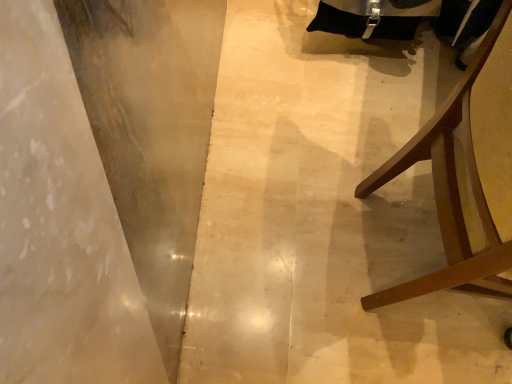
What do you see at coordinates (451, 192) in the screenshot? This screenshot has width=512, height=384. I see `brown wood chair at right` at bounding box center [451, 192].

Where is `brown wood chair at right`? brown wood chair at right is located at coordinates (451, 192).

Measure the distance between point [291,359] and camera.

Point [291,359] is 3.54 feet from camera.

What do you see at coordinates (325, 216) in the screenshot?
I see `smooth concrete at left` at bounding box center [325, 216].

Find the location of a particular element. The height and width of the screenshot is (384, 512). smooth concrete at left is located at coordinates (325, 216).

Where is `brown wood chair at right`? brown wood chair at right is located at coordinates (451, 192).

Does smooth concrete at left appear on the right side of brown wood chair at right?

No.

Which is behind, smooth concrete at left or brown wood chair at right?

smooth concrete at left is further from the camera.

Which point is more distant from viewer, [224,189] or [493,233]?

The point [224,189] is farther from the camera.

From the image's perspective, between smooth concrete at left and brown wood chair at right, who is located below?

brown wood chair at right, from the image's perspective.

From a real-world perspective, is smooth concrete at left positioned above or below brown wood chair at right?

smooth concrete at left is below brown wood chair at right.

Is smooth concrete at left wider than brown wood chair at right?

Yes.

Between smooth concrete at left and brown wood chair at right, which one has more height?

Standing taller between the two is brown wood chair at right.

Considering the sizes of smooth concrete at left and brown wood chair at right in the image, is smooth concrete at left bigger or smaller than brown wood chair at right?

In the image, smooth concrete at left appears to be smaller than brown wood chair at right.

Is smooth concrete at left outside of brown wood chair at right?

Yes, smooth concrete at left is located beyond the bounds of brown wood chair at right.

Is smooth concrete at left placed right next to brown wood chair at right?

No, smooth concrete at left is not in contact with brown wood chair at right.

Is smooth concrete at left oriented away from brown wood chair at right?

No, brown wood chair at right is not at the back of smooth concrete at left.

Consider the image. What's the angular difference between smooth concrete at left and brown wood chair at right's facing directions?

They differ by 92 degrees in their facing directions.

Measure the distance from smooth concrete at left to brown wood chair at right.

A distance of 14.00 inches exists between smooth concrete at left and brown wood chair at right.

Identify the location of furniture located on the right of smooth concrete at left. (451, 192).

Considering the relative positions of brown wood chair at right and smooth concrete at left in the image provided, is brown wood chair at right to the left or to the right of smooth concrete at left?

From the image, it's evident that brown wood chair at right is to the right of smooth concrete at left.

Is the depth of brown wood chair at right greater than that of smooth concrete at left?

No, it is not.

Is point (467, 252) behind point (439, 239)?

That is False.

From the image's perspective, which is below, brown wood chair at right or smooth concrete at left?

brown wood chair at right.

From a real-world perspective, who is located lower, brown wood chair at right or smooth concrete at left?

smooth concrete at left is physically lower.

Is brown wood chair at right wider than smooth concrete at left?

No.

Who is taller, brown wood chair at right or smooth concrete at left?

brown wood chair at right is taller.

Is brown wood chair at right bigger or smaller than smooth concrete at left?

brown wood chair at right is bigger than smooth concrete at left.

Would you say brown wood chair at right is outside smooth concrete at left?

Yes.

Is brown wood chair at right directly adjacent to smooth concrete at left?

They are not placed beside each other.

Is brown wood chair at right facing towards smooth concrete at left?

No, brown wood chair at right is not facing towards smooth concrete at left.

In order to click on furniture that is in front of the smooth concrete at left in this screenshot , I will do `click(451, 192)`.

There is a smooth concrete at left. Where is `furniture above it (from a real-world perspective)`? furniture above it (from a real-world perspective) is located at coordinates (451, 192).

You are a GUI agent. You are given a task and a screenshot of the screen. Output one action in this format:
    pyautogui.click(x=<x>, y=<y>)
    Task: Click on the furniture in front of the smooth concrete at left
    The height and width of the screenshot is (384, 512).
    Given the screenshot: What is the action you would take?
    pyautogui.click(x=451, y=192)